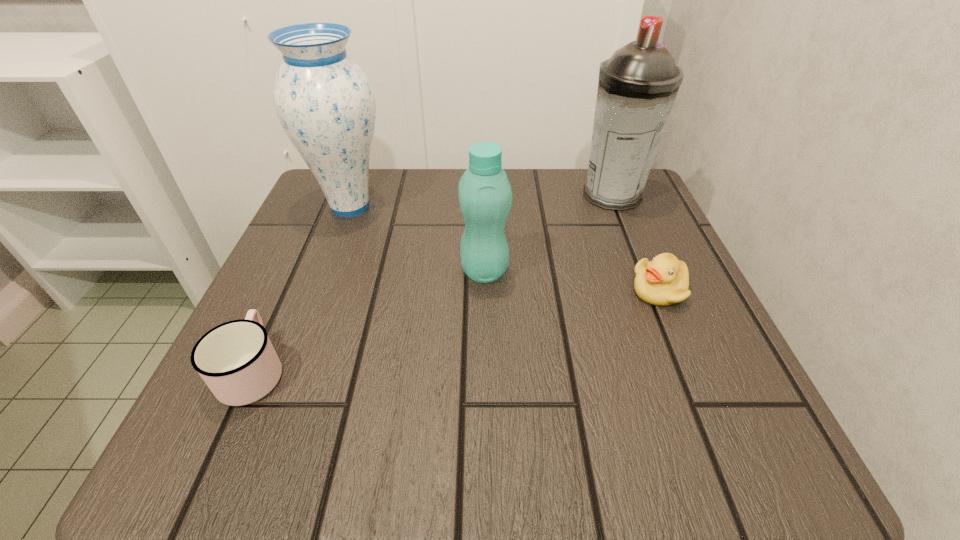
At what (x,y) coordinates should I click in order to perform the action: click on aerosol can. Please return your answer as a coordinate pair (x, y). This screenshot has height=540, width=960. Looking at the image, I should click on [638, 84].

Identify the location of vase. This screenshot has width=960, height=540. (325, 103).

At what (x,y) coordinates should I click in order to perform the action: click on bottle. Please return your answer as a coordinate pair (x, y). The height and width of the screenshot is (540, 960). Looking at the image, I should click on (485, 197).

At what (x,y) coordinates should I click in order to perform the action: click on the third object from right to left. Please return your answer as a coordinate pair (x, y). Looking at the image, I should click on click(x=485, y=197).

Where is `duckling`? duckling is located at coordinates (663, 281).

I want to click on mug, so click(x=237, y=361).

Where is `free spot located 0.150m on the front of the aerosol can`? Image resolution: width=960 pixels, height=540 pixels. free spot located 0.150m on the front of the aerosol can is located at coordinates tap(638, 262).

In order to click on vacant space located 0.190m on the front of the vase in this screenshot , I will do `click(315, 300)`.

The height and width of the screenshot is (540, 960). Identify the location of free space located on the front of the third shortest object. (485, 348).

The width and height of the screenshot is (960, 540). In order to click on free region located 0.350m on the beak of the duckling in this screenshot , I will do `click(428, 290)`.